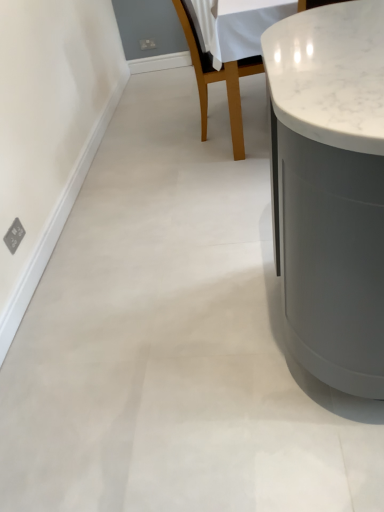
Question: From the image's perspective, is white marble countertop at upper right located beneath wooden chair at center?

Choices:
 (A) yes
 (B) no

Answer: (B)

Question: Does white marble countertop at upper right have a larger size compared to wooden chair at center?

Choices:
 (A) yes
 (B) no

Answer: (A)

Question: Are white marble countertop at upper right and wooden chair at center located far from each other?

Choices:
 (A) yes
 (B) no

Answer: (A)

Question: Is white marble countertop at upper right positioned with its back to wooden chair at center?

Choices:
 (A) yes
 (B) no

Answer: (B)

Question: Is white marble countertop at upper right oriented towards wooden chair at center?

Choices:
 (A) no
 (B) yes

Answer: (A)

Question: Considering the relative sizes of white marble countertop at upper right and wooden chair at center in the image provided, is white marble countertop at upper right wider than wooden chair at center?

Choices:
 (A) yes
 (B) no

Answer: (A)

Question: Is wooden chair at center thinner than white marble countertop at upper right?

Choices:
 (A) yes
 (B) no

Answer: (A)

Question: Are wooden chair at center and white marble countertop at upper right far apart?

Choices:
 (A) no
 (B) yes

Answer: (B)

Question: Is wooden chair at center oriented away from white marble countertop at upper right?

Choices:
 (A) yes
 (B) no

Answer: (A)

Question: Considering the relative positions of wooden chair at center and white marble countertop at upper right in the image provided, is wooden chair at center to the left of white marble countertop at upper right from the viewer's perspective?

Choices:
 (A) no
 (B) yes

Answer: (B)

Question: Is wooden chair at center positioned beyond the bounds of white marble countertop at upper right?

Choices:
 (A) no
 (B) yes

Answer: (A)

Question: Is wooden chair at center at the right side of white marble countertop at upper right?

Choices:
 (A) yes
 (B) no

Answer: (B)

Question: From a real-world perspective, is wooden chair at center physically located above or below white marble countertop at upper right?

Choices:
 (A) above
 (B) below

Answer: (A)